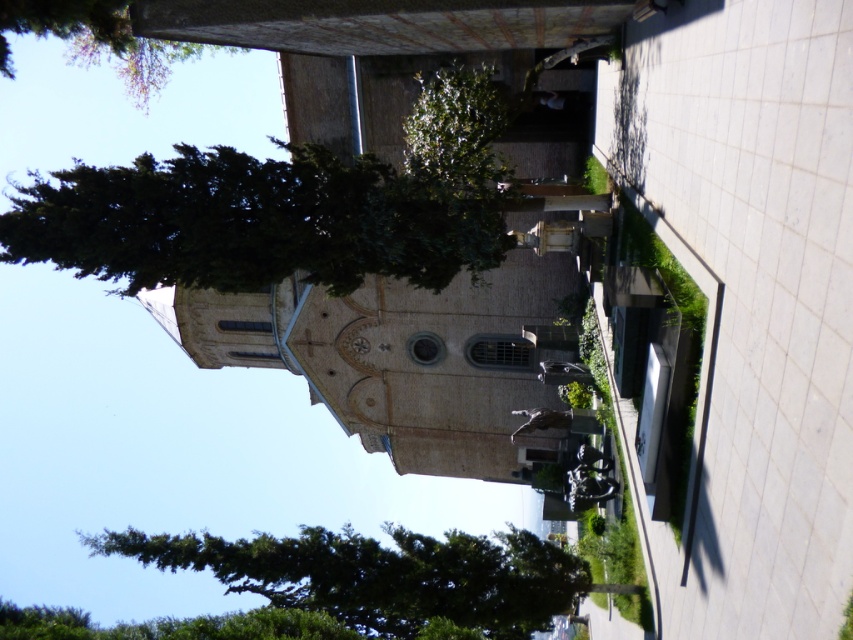
Describe the element at coordinates (456, 131) in the screenshot. The height and width of the screenshot is (640, 853). I see `green leafy tree at center` at that location.

Find the location of `green leafy tree at center`. green leafy tree at center is located at coordinates pos(456,131).

From the picture: Between green textured tree at left and green leafy tree at upper left, which one appears on the left side from the viewer's perspective?

green leafy tree at upper left

Who is positioned more to the right, green textured tree at left or green leafy tree at upper left?

green textured tree at left is more to the right.

Between point (349, 604) and point (78, 40), which one is positioned in front?

Point (349, 604) is more forward.

The width and height of the screenshot is (853, 640). Identify the location of green textured tree at left. (380, 573).

Does point (453, 227) come closer to viewer compared to point (91, 54)?

Yes, point (453, 227) is in front of point (91, 54).

Does dark green leafy tree at upper left have a lesser width compared to green leafy tree at upper left?

Yes.

Image resolution: width=853 pixels, height=640 pixels. In order to click on dark green leafy tree at upper left in this screenshot , I will do pyautogui.click(x=265, y=218).